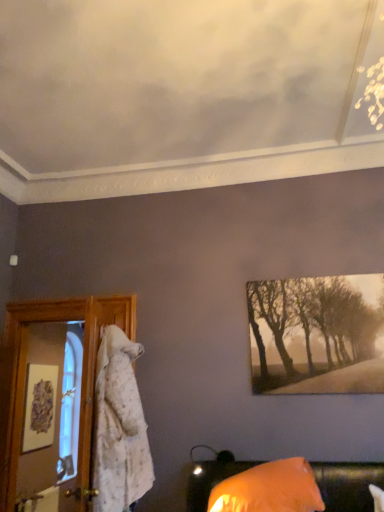
Question: From the image's perspective, is matte white picture frame at left located above or below sepia-toned canvas at upper right?

Choices:
 (A) above
 (B) below

Answer: (B)

Question: Is point (41, 394) positioned closer to the camera than point (344, 289)?

Choices:
 (A) farther
 (B) closer

Answer: (A)

Question: Which is farther from the orange fabric pillow at lower right?

Choices:
 (A) sepia-toned canvas at upper right
 (B) matte white picture frame at left

Answer: (B)

Question: Which is farther from the orange fabric pillow at lower right?

Choices:
 (A) sepia-toned canvas at upper right
 (B) matte white picture frame at left

Answer: (B)